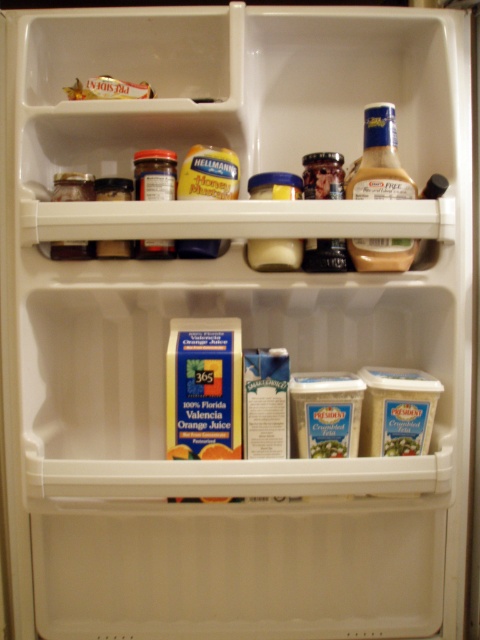
Question: Does translucent plastic mustard at upper right appear on the right side of gold foil packet at upper left?

Choices:
 (A) yes
 (B) no

Answer: (A)

Question: Which point is farther to the camera?

Choices:
 (A) (380, 120)
 (B) (115, 96)

Answer: (B)

Question: Does translucent plastic mustard at upper right appear over gold foil packet at upper left?

Choices:
 (A) yes
 (B) no

Answer: (B)

Question: Among these objects, which one is farthest from the camera?

Choices:
 (A) translucent plastic mustard at upper right
 (B) gold foil packet at upper left

Answer: (B)

Question: Is translucent plastic mustard at upper right closer to the viewer compared to gold foil packet at upper left?

Choices:
 (A) no
 (B) yes

Answer: (B)